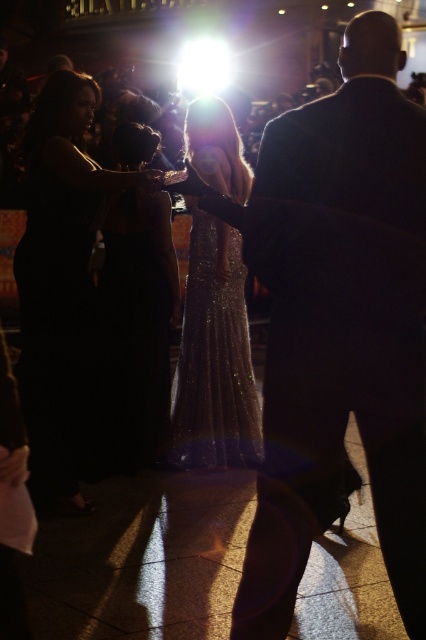
Consider the image. Can you confirm if black satin dress at center is smaller than sparkly gold dress at center?

No.

Can you confirm if black satin dress at center is positioned to the left of sparkly gold dress at center?

Correct, you'll find black satin dress at center to the left of sparkly gold dress at center.

Does point (126, 189) come behind point (247, 333)?

No.

Locate an element on the screen. black satin dress at center is located at coordinates (135, 328).

Identify the location of shiny black suit at center. (339, 326).

Which is in front, point (337, 163) or point (230, 308)?

Point (337, 163) is in front.

Where is `shiny black suit at center`? shiny black suit at center is located at coordinates (339, 326).

In the scene shown: Who is more forward, (x=411, y=161) or (x=146, y=323)?

Point (x=411, y=161) is more forward.

Between shiny black suit at center and black satin dress at center, which one appears on the left side from the viewer's perspective?

Positioned to the left is black satin dress at center.

Where is `shiny black suit at center`? The width and height of the screenshot is (426, 640). shiny black suit at center is located at coordinates (339, 326).

Locate an element on the screen. Image resolution: width=426 pixels, height=640 pixels. shiny black suit at center is located at coordinates (339, 326).